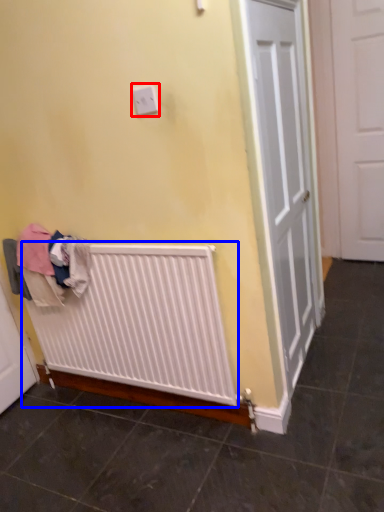
Question: Which object appears closest to the camera in this image, electric outlet (highlighted by a red box) or radiator (highlighted by a blue box)?

Choices:
 (A) electric outlet
 (B) radiator

Answer: (A)